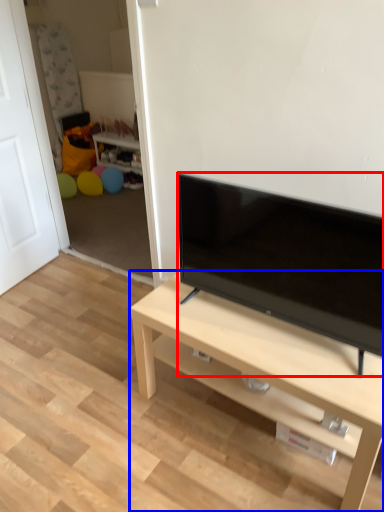
Question: Which object appears closest to the camera in this image, television (highlighted by a red box) or desk (highlighted by a blue box)?

Choices:
 (A) television
 (B) desk

Answer: (A)